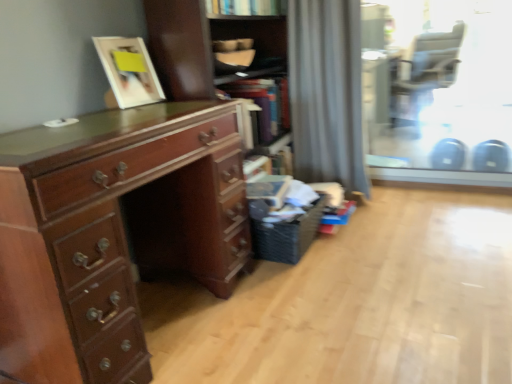
Question: Considering the positions of wooden cabinet at center and shiny brown wooden desk at left in the image, is wooden cabinet at center bigger or smaller than shiny brown wooden desk at left?

Choices:
 (A) big
 (B) small

Answer: (A)

Question: Based on their positions, is wooden cabinet at center located to the left or right of shiny brown wooden desk at left?

Choices:
 (A) right
 (B) left

Answer: (A)

Question: Which of these objects is positioned closest to the matte black armchair at upper right?

Choices:
 (A) black woven laundry basket at lower right
 (B) gray fabric curtain at center
 (C) wooden cabinet at center
 (D) matte white picture frame at upper left
 (E) shiny brown wooden desk at left

Answer: (B)

Question: Which object is positioned closest to the matte black armchair at upper right?

Choices:
 (A) matte white picture frame at upper left
 (B) shiny brown wooden desk at left
 (C) gray fabric curtain at center
 (D) transparent glass door at upper right
 (E) black woven laundry basket at lower right

Answer: (D)